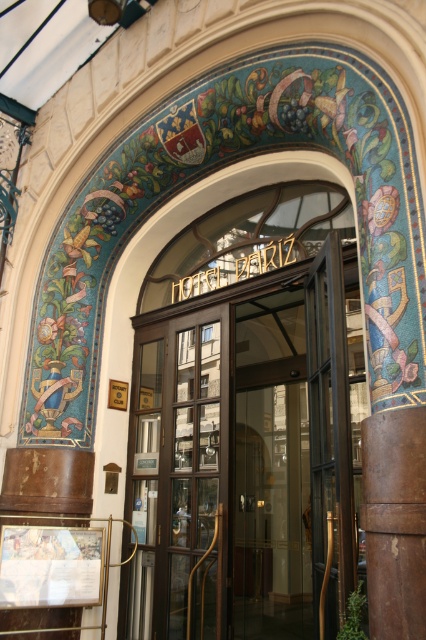
Which is below, polished brass door at center or brown leather pillar at center?

polished brass door at center is lower down.

Does point (192, 388) come behind point (414, 444)?

Yes.

Between point (244, 280) and point (417, 566), which one is positioned behind?

Positioned behind is point (244, 280).

Find the location of a particular element. This screenshot has width=426, height=640. polished brass door at center is located at coordinates (244, 454).